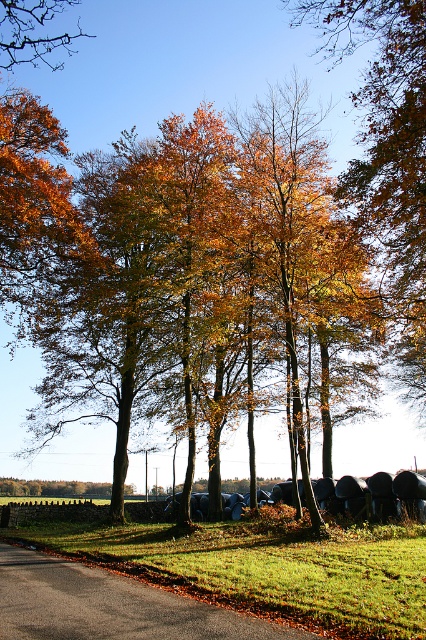
Question: Does golden leaves at center appear on the right side of green grass at lower center?

Choices:
 (A) yes
 (B) no

Answer: (B)

Question: Which point is farther to the camera?

Choices:
 (A) (54, 536)
 (B) (51, 65)

Answer: (B)

Question: Which point is farther from the camera taking this photo?

Choices:
 (A) (405, 566)
 (B) (26, 49)

Answer: (B)

Question: Does golden leaves at center appear over brown leafy tree at upper left?

Choices:
 (A) yes
 (B) no

Answer: (B)

Question: Which of these objects is positioned farthest from the green grass at lower center?

Choices:
 (A) golden leaves at center
 (B) brown leafy tree at upper left

Answer: (B)

Question: Does golden leaves at center appear on the right side of green grass at lower center?

Choices:
 (A) yes
 (B) no

Answer: (B)